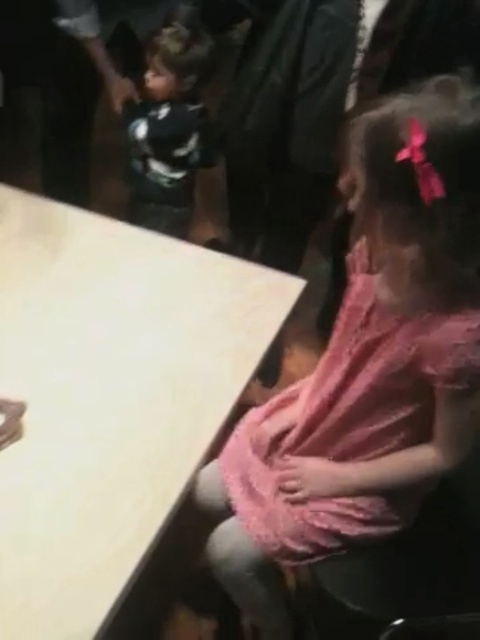
You are standing at the center of the room and want to place a small cake on the white matte table at lower left. To reach the table, should you walk towards the lower left or upper right direction?

The white matte table at lower left is located at point (109,396), which is in the lower left quadrant of the room. Since you are at the center, you should walk towards the lower left direction to reach it.

You are a photographer at the event and need to place a small camera on the white matte table at lower left without blocking the black matte shirt at upper left. Is there enough space on the table?

The white matte table at lower left is larger in size than the black matte shirt at upper left, so there should be sufficient space to place the camera on the table without blocking the shirt.

You are at a party and need to find the pink lace dress at lower right. Where should you look relative to the black matte shirt at upper left?

The pink lace dress at lower right is positioned under the black matte shirt at upper left, so look below the black matte shirt at upper left to find it.